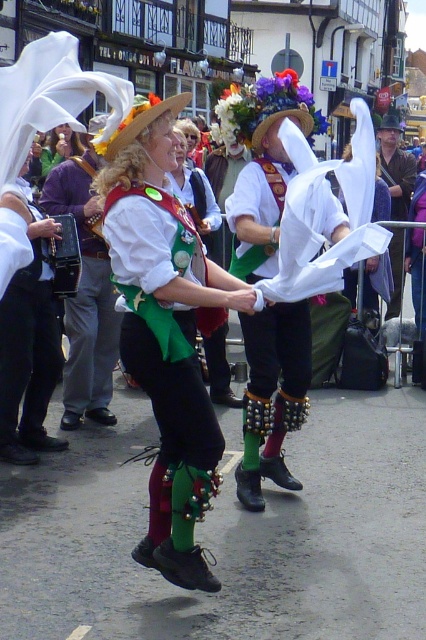
Question: Can you confirm if green velvet vest at center is wider than brown leather jacket at center?

Choices:
 (A) no
 (B) yes

Answer: (B)

Question: Which point is closer to the camera?

Choices:
 (A) brown leather jacket at center
 (B) green velvet vest at center

Answer: (B)

Question: Does green velvet vest at center have a smaller size compared to brown leather jacket at center?

Choices:
 (A) yes
 (B) no

Answer: (A)

Question: Which of the following is the closest to the observer?

Choices:
 (A) brown leather jacket at center
 (B) green velvet vest at center

Answer: (B)

Question: Which object appears farthest from the camera in this image?

Choices:
 (A) brown leather jacket at center
 (B) green velvet vest at center

Answer: (A)

Question: Can you confirm if green velvet vest at center is smaller than brown leather jacket at center?

Choices:
 (A) yes
 (B) no

Answer: (A)